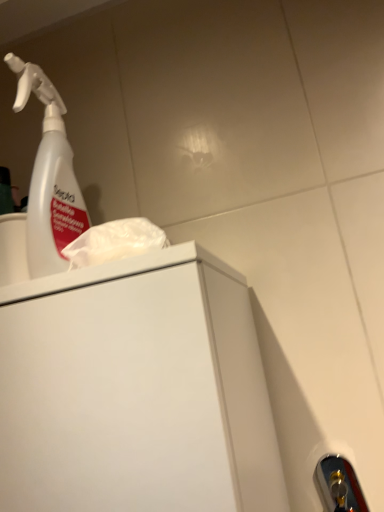
Question: Is transparent plastic spray bottle at upper left taller or shorter than gold metallic door handle at lower right?

Choices:
 (A) tall
 (B) short

Answer: (A)

Question: Is transparent plastic spray bottle at upper left in front of or behind gold metallic door handle at lower right in the image?

Choices:
 (A) behind
 (B) front

Answer: (B)

Question: Is transparent plastic spray bottle at upper left wider or thinner than gold metallic door handle at lower right?

Choices:
 (A) wide
 (B) thin

Answer: (A)

Question: Considering the positions of gold metallic door handle at lower right and transparent plastic spray bottle at upper left in the image, is gold metallic door handle at lower right bigger or smaller than transparent plastic spray bottle at upper left?

Choices:
 (A) big
 (B) small

Answer: (B)

Question: In terms of height, does gold metallic door handle at lower right look taller or shorter compared to transparent plastic spray bottle at upper left?

Choices:
 (A) tall
 (B) short

Answer: (B)

Question: Looking at their shapes, would you say gold metallic door handle at lower right is wider or thinner than transparent plastic spray bottle at upper left?

Choices:
 (A) wide
 (B) thin

Answer: (B)

Question: Is gold metallic door handle at lower right inside or outside of transparent plastic spray bottle at upper left?

Choices:
 (A) outside
 (B) inside

Answer: (A)